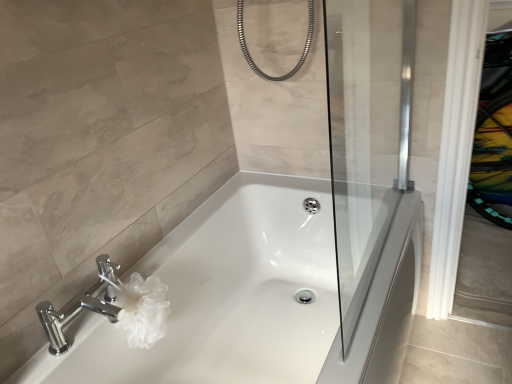
Question: Can you confirm if transparent glass screen door at center is shorter than chrome/metallic faucet at lower left?

Choices:
 (A) yes
 (B) no

Answer: (B)

Question: Does transparent glass screen door at center appear on the left side of chrome/metallic faucet at lower left?

Choices:
 (A) yes
 (B) no

Answer: (B)

Question: Would you consider transparent glass screen door at center to be distant from chrome/metallic faucet at lower left?

Choices:
 (A) no
 (B) yes

Answer: (A)

Question: Is the position of transparent glass screen door at center more distant than that of chrome/metallic faucet at lower left?

Choices:
 (A) yes
 (B) no

Answer: (B)

Question: Can you confirm if transparent glass screen door at center is positioned to the right of chrome/metallic faucet at lower left?

Choices:
 (A) no
 (B) yes

Answer: (B)

Question: Considering the relative sizes of transparent glass screen door at center and chrome/metallic faucet at lower left in the image provided, is transparent glass screen door at center taller than chrome/metallic faucet at lower left?

Choices:
 (A) yes
 (B) no

Answer: (A)

Question: Is chrome/metallic faucet at lower left with transparent glass screen door at center?

Choices:
 (A) no
 (B) yes

Answer: (A)

Question: Is chrome/metallic faucet at lower left aimed at transparent glass screen door at center?

Choices:
 (A) yes
 (B) no

Answer: (B)

Question: Does chrome/metallic faucet at lower left have a greater width compared to transparent glass screen door at center?

Choices:
 (A) yes
 (B) no

Answer: (A)

Question: From the image's perspective, is chrome/metallic faucet at lower left under transparent glass screen door at center?

Choices:
 (A) yes
 (B) no

Answer: (A)

Question: Does chrome/metallic faucet at lower left have a lesser width compared to transparent glass screen door at center?

Choices:
 (A) no
 (B) yes

Answer: (A)

Question: Is chrome/metallic faucet at lower left oriented away from transparent glass screen door at center?

Choices:
 (A) no
 (B) yes

Answer: (A)

Question: From the image's perspective, is chrome/metallic faucet at lower left located above white glossy bathtub at center?

Choices:
 (A) no
 (B) yes

Answer: (B)